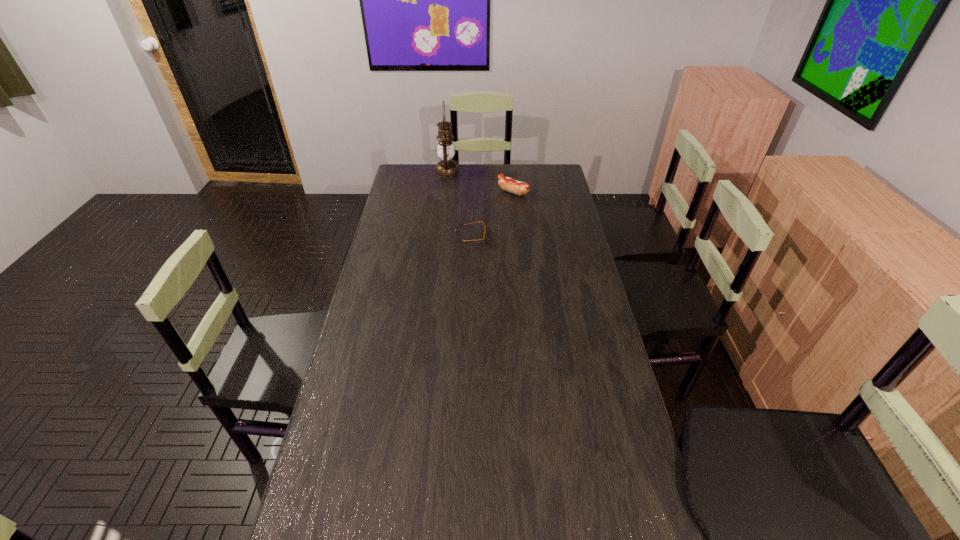
Locate an element on the screen. the second closest object to the sunglasses is located at coordinates (446, 167).

The height and width of the screenshot is (540, 960). In order to click on free space that satisfies the following two spatial constraints: 1. on the front side of the sausage; 2. on the left side of the oil lamp in this screenshot , I will do `click(444, 193)`.

Locate an element on the screen. This screenshot has height=540, width=960. free region that satisfies the following two spatial constraints: 1. on the front side of the rightmost object; 2. on the right side of the farthest object is located at coordinates (444, 193).